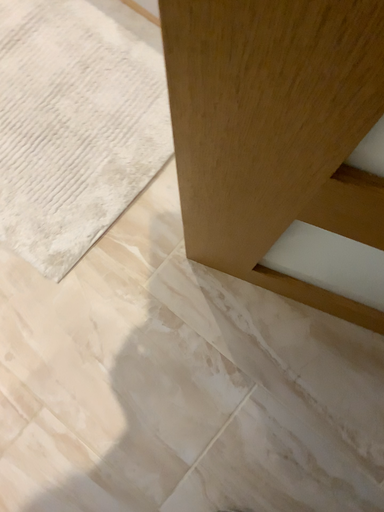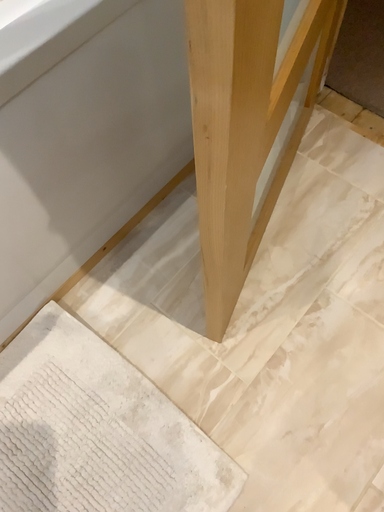
Question: How did the camera likely rotate when shooting the video?

Choices:
 (A) rotated upward
 (B) rotated downward

Answer: (A)